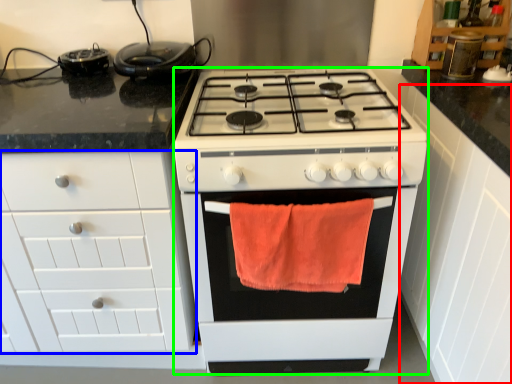
Question: Based on their relative distances, which object is farther from cabinetry (highlighted by a red box)? Choose from cabinetry (highlighted by a blue box) and appliance (highlighted by a green box).

Choices:
 (A) cabinetry
 (B) appliance

Answer: (A)